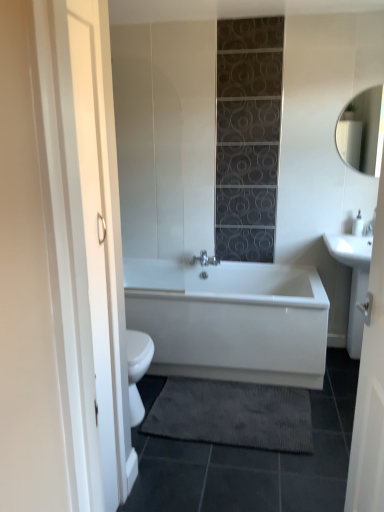
Question: Is silver metallic faucet at right smaller than white glossy bathtub at center?

Choices:
 (A) no
 (B) yes

Answer: (B)

Question: Considering the relative positions of silver metallic faucet at right and white glossy bathtub at center in the image provided, is silver metallic faucet at right to the right of white glossy bathtub at center from the viewer's perspective?

Choices:
 (A) yes
 (B) no

Answer: (A)

Question: From the image's perspective, would you say silver metallic faucet at right is shown under white glossy bathtub at center?

Choices:
 (A) no
 (B) yes

Answer: (A)

Question: Can you confirm if silver metallic faucet at right is wider than white glossy bathtub at center?

Choices:
 (A) yes
 (B) no

Answer: (B)

Question: Is silver metallic faucet at right positioned with its back to white glossy bathtub at center?

Choices:
 (A) no
 (B) yes

Answer: (A)

Question: In terms of width, does silver metallic faucet at right look wider or thinner when compared to white glossy sink at right?

Choices:
 (A) wide
 (B) thin

Answer: (B)

Question: From a real-world perspective, is silver metallic faucet at right positioned above or below white glossy sink at right?

Choices:
 (A) above
 (B) below

Answer: (A)

Question: In the image, is silver metallic faucet at right positioned in front of or behind white glossy sink at right?

Choices:
 (A) front
 (B) behind

Answer: (B)

Question: Is silver metallic faucet at right to the left or to the right of white glossy sink at right in the image?

Choices:
 (A) right
 (B) left

Answer: (A)

Question: From the image's perspective, is matte white mirror at upper right located above or below dark gray textured bath mat at lower center?

Choices:
 (A) above
 (B) below

Answer: (A)

Question: Based on their positions, is matte white mirror at upper right located to the left or right of dark gray textured bath mat at lower center?

Choices:
 (A) left
 (B) right

Answer: (B)

Question: In terms of width, does matte white mirror at upper right look wider or thinner when compared to dark gray textured bath mat at lower center?

Choices:
 (A) thin
 (B) wide

Answer: (A)

Question: Choose the correct answer: Is matte white mirror at upper right inside dark gray textured bath mat at lower center or outside it?

Choices:
 (A) inside
 (B) outside

Answer: (B)

Question: In the image, is white glossy sink at right positioned in front of or behind silver metallic faucet at right?

Choices:
 (A) behind
 (B) front

Answer: (B)

Question: Would you say white glossy sink at right is to the left or to the right of silver metallic faucet at right in the picture?

Choices:
 (A) right
 (B) left

Answer: (B)